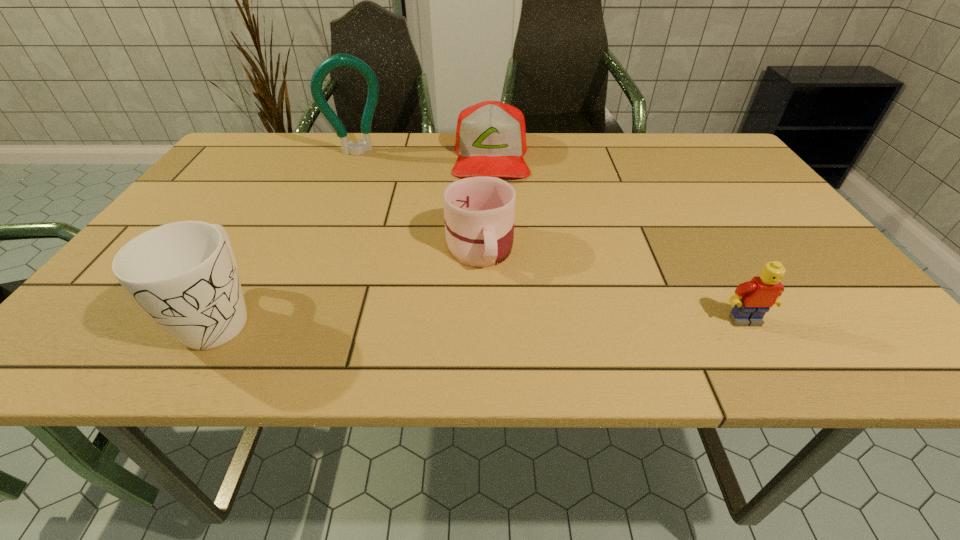
Identify the location of vacant space on the desktop that is between the left mug and the Lego and is positioned on the side with the handle of the shorter mug. coord(492,318).

Image resolution: width=960 pixels, height=540 pixels. What are the coordinates of `vacant spot on the desktop that is between the left mug and the Lego and is positioned on the front-facing side of the baseball cap` in the screenshot? It's located at (494, 318).

The image size is (960, 540). Identify the location of free space on the desktop that is between the second tallest object and the rightmost object and is positioned at the jaws of the tallest object. (x=420, y=317).